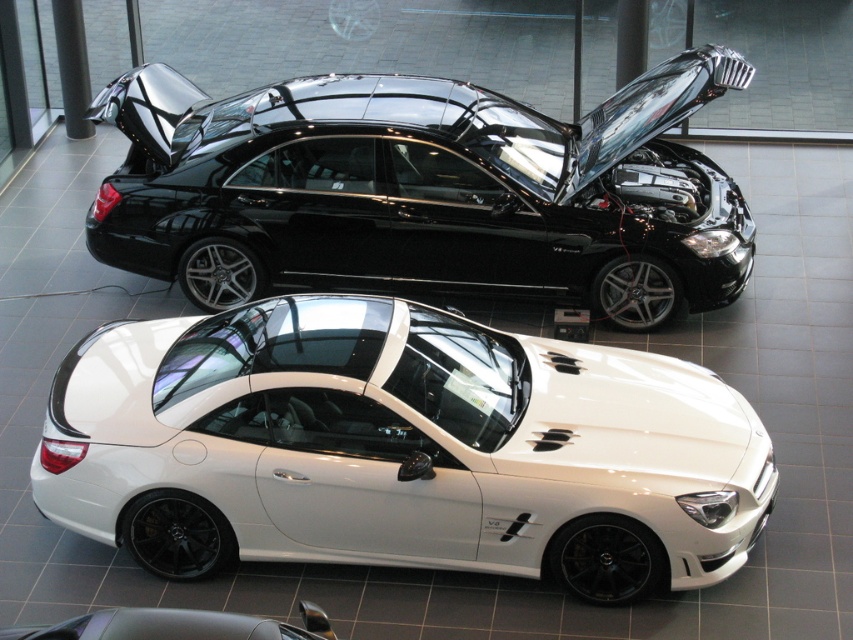
Can you confirm if white glossy sedan at center is smaller than black metallic sedan at center?

Indeed, white glossy sedan at center has a smaller size compared to black metallic sedan at center.

Is white glossy sedan at center wider than black metallic sedan at center?

In fact, white glossy sedan at center might be narrower than black metallic sedan at center.

This screenshot has width=853, height=640. Find the location of `white glossy sedan at center`. white glossy sedan at center is located at coordinates (399, 449).